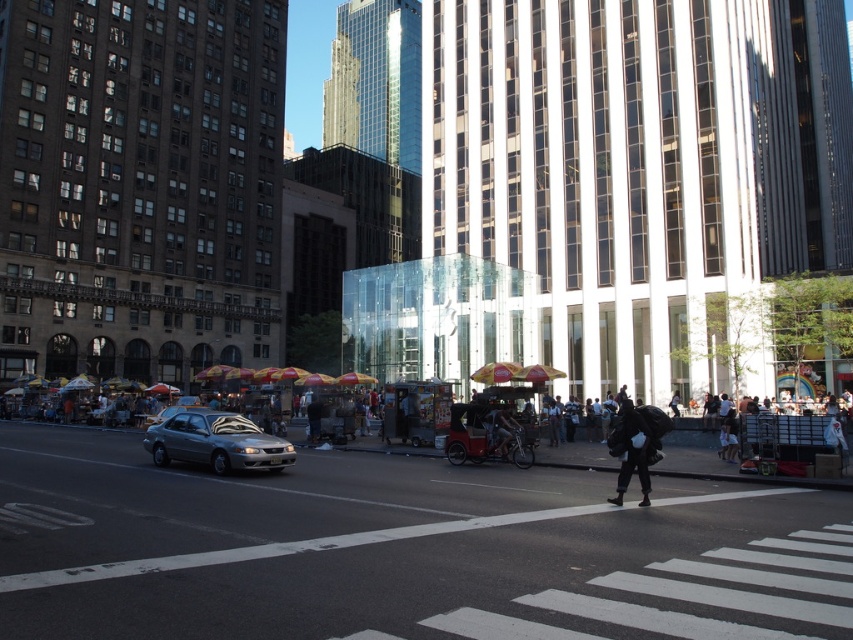
You are a pedestrian at the crosswalk. You see the satin silver sedan at center and the black matte backpack at lower right. Which object is closer to the left side of the crosswalk?

The satin silver sedan at center is to the left of the black matte backpack at lower right, so it is closer to the left side of the crosswalk.

Based on the scene description, where is the satin silver sedan at center located in the image?

The satin silver sedan at center is located at point coordinates of 0.692 on the x axis and 0.254 on the y axis.